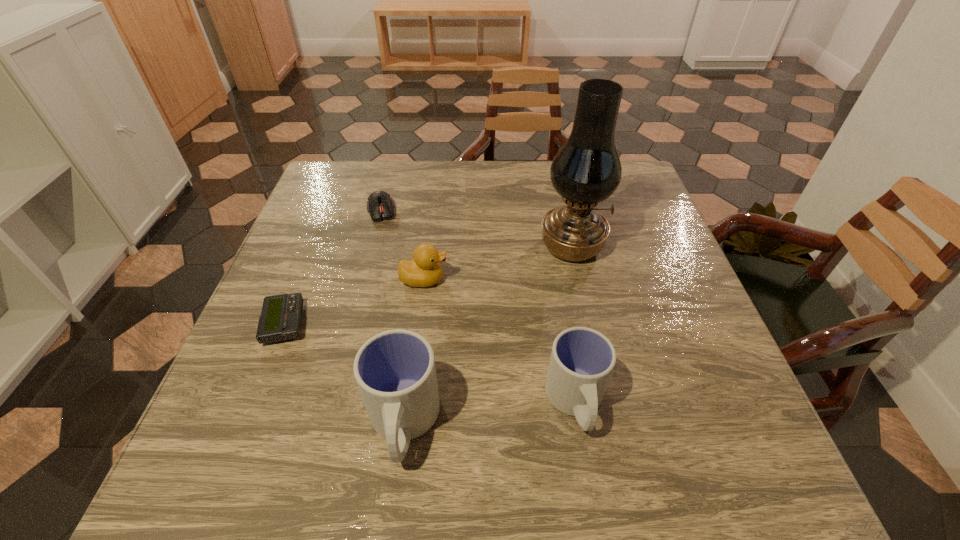
You are a GUI agent. You are given a task and a screenshot of the screen. Output one action in this format:
    pyautogui.click(x=<x>, y=<y>)
    Task: Click on the taller cup
    The width and height of the screenshot is (960, 540).
    Given the screenshot: What is the action you would take?
    pyautogui.click(x=395, y=371)

Find the location of a particular element. the left cup is located at coordinates (395, 371).

Identify the location of the third tallest object. This screenshot has height=540, width=960. (582, 360).

You are a GUI agent. You are given a task and a screenshot of the screen. Output one action in this format:
    pyautogui.click(x=<x>, y=<y>)
    Task: Click on the right cup
    
    Given the screenshot: What is the action you would take?
    pyautogui.click(x=582, y=360)

Locate an element on the screen. the second object from left to right is located at coordinates (380, 205).

Locate an element on the screen. Image resolution: width=960 pixels, height=540 pixels. the farthest object is located at coordinates (380, 205).

The image size is (960, 540). I want to click on beeper, so click(x=281, y=316).

At what (x,y) coordinates should I click in order to perform the action: click on the leftmost object. Please return your answer as a coordinate pair (x, y). This screenshot has height=540, width=960. Looking at the image, I should click on (281, 316).

This screenshot has height=540, width=960. Identify the location of the tallest object. (587, 170).

The height and width of the screenshot is (540, 960). Find the location of `duckling`. duckling is located at coordinates (424, 270).